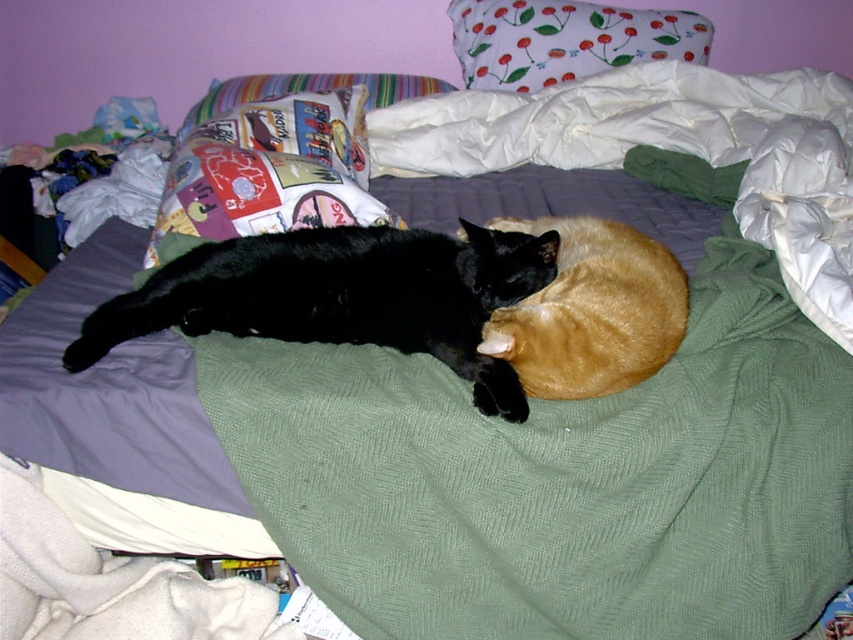
Question: Which of the following is the closest to the observer?

Choices:
 (A) (218, 317)
 (B) (508, 29)
 (C) (563, 291)
 (D) (241, 186)

Answer: (C)

Question: From the image, what is the correct spatial relationship of multicolored fabric pillow at upper left in relation to golden fur cat at center?

Choices:
 (A) left
 (B) right

Answer: (A)

Question: Which object is the closest to the golden fur cat at center?

Choices:
 (A) floral fabric pillow at upper center
 (B) black fur cat at center
 (C) multicolored fabric pillow at upper left

Answer: (B)

Question: Is golden fur cat at center to the right of floral fabric pillow at upper center from the viewer's perspective?

Choices:
 (A) no
 (B) yes

Answer: (A)

Question: Which point is farther from the camera taking this photo?

Choices:
 (A) (618, 323)
 (B) (161, 268)
 (C) (248, 145)

Answer: (C)

Question: Considering the relative positions of black fur cat at center and multicolored fabric pillow at upper left in the image provided, where is black fur cat at center located with respect to multicolored fabric pillow at upper left?

Choices:
 (A) left
 (B) right

Answer: (B)